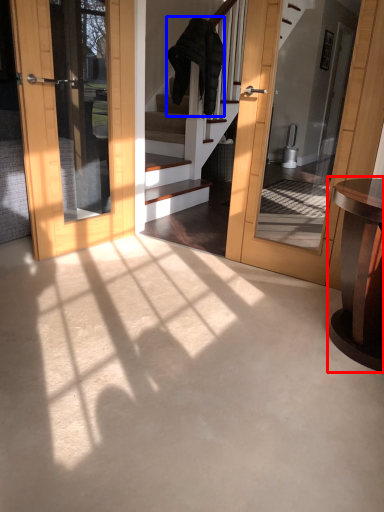
Question: Which of the following is the closest to the observer, table (highlighted by a red box) or robe (highlighted by a blue box)?

Choices:
 (A) table
 (B) robe

Answer: (A)